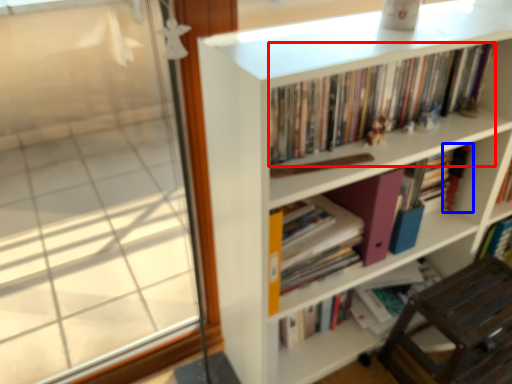
Question: Which object is further to the camera taking this photo, book (highlighted by a red box) or book (highlighted by a blue box)?

Choices:
 (A) book
 (B) book

Answer: (B)